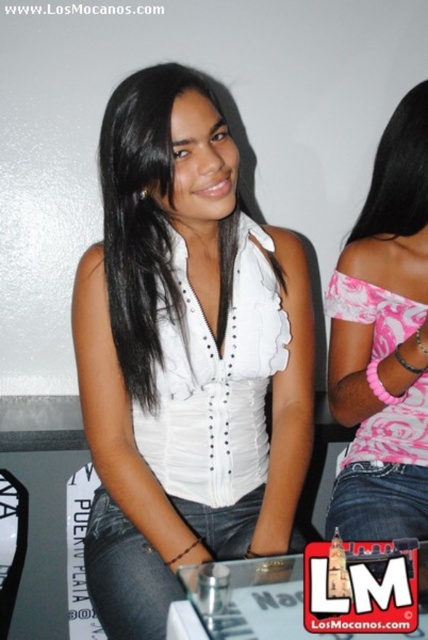
Consider the image. Is jeans at center positioned at the back of black smooth hair at upper right?

No.

Between jeans at center and black smooth hair at upper right, which one has less height?

Standing shorter between the two is jeans at center.

Describe the element at coordinates (125, 576) in the screenshot. The image size is (428, 640). I see `jeans at center` at that location.

Locate an element on the screen. The image size is (428, 640). jeans at center is located at coordinates (125, 576).

Which of these two, white satin blouse at center or jeans at center, stands shorter?

jeans at center

Who is more forward, (98, 465) or (124, 620)?

Point (124, 620) is more forward.

This screenshot has height=640, width=428. In order to click on white satin blouse at center in this screenshot , I will do `click(184, 355)`.

Can you confirm if white satin blouse at center is positioned to the left of jeans at lower right?

Correct, you'll find white satin blouse at center to the left of jeans at lower right.

Looking at this image, does white satin blouse at center come in front of jeans at lower right?

Yes.

This screenshot has height=640, width=428. Describe the element at coordinates (184, 355) in the screenshot. I see `white satin blouse at center` at that location.

What are the coordinates of `white satin blouse at center` in the screenshot? It's located at (184, 355).